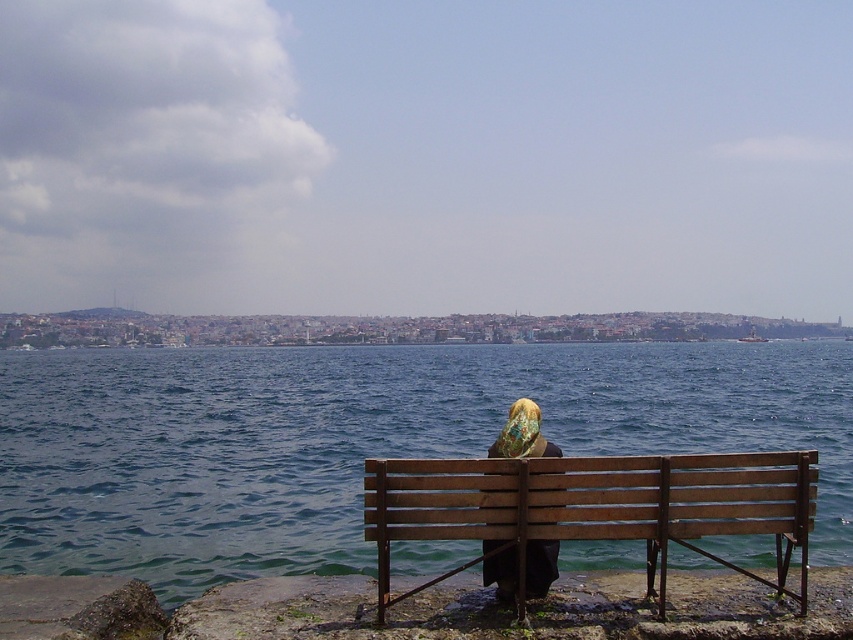
Is blue water at center thinner than wooden bench at lower center?

In fact, blue water at center might be wider than wooden bench at lower center.

Does point (436, 433) come farther from viewer compared to point (712, 474)?

That is True.

Locate an element on the screen. blue water at center is located at coordinates (358, 440).

Identify the location of blue water at center. (358, 440).

Does blue water at center have a lesser height compared to matte black headscarf at center?

Incorrect, blue water at center's height does not fall short of matte black headscarf at center's.

Does blue water at center come behind matte black headscarf at center?

Yes.

Who is more distant from viewer, [125,468] or [527,433]?

The point [125,468] is more distant.

The height and width of the screenshot is (640, 853). I want to click on blue water at center, so click(x=358, y=440).

Can you confirm if wooden bench at lower center is positioned above matte black headscarf at center?

Indeed, wooden bench at lower center is positioned over matte black headscarf at center.

Between point (705, 480) and point (527, 452), which one is positioned in front?

Point (705, 480) is more forward.

Find the location of a particular element. This screenshot has width=853, height=640. wooden bench at lower center is located at coordinates (592, 508).